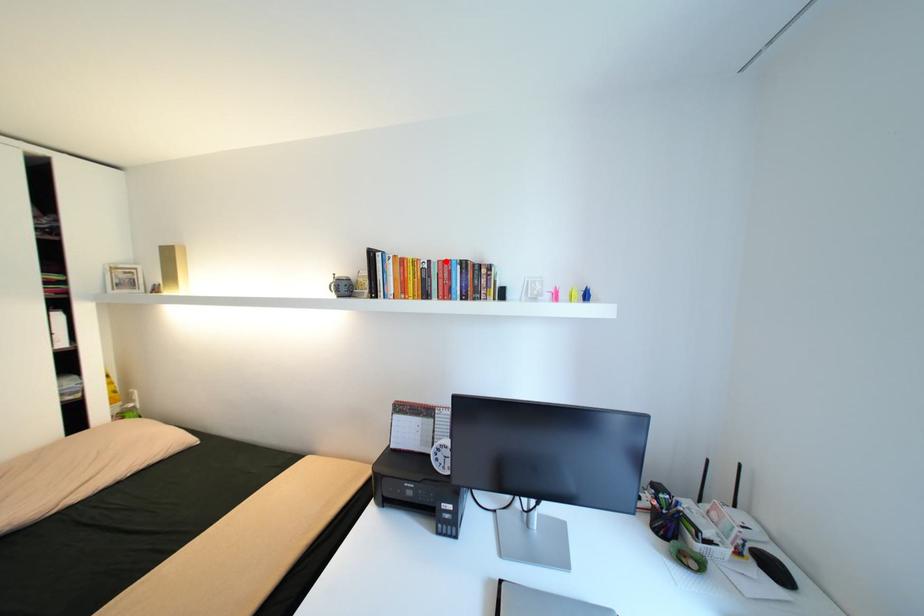
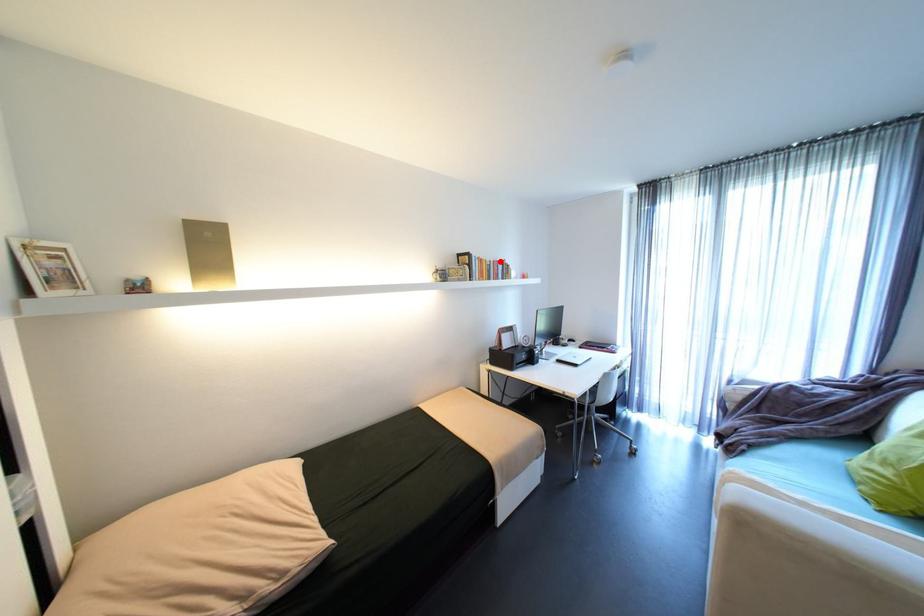
I am providing you with two images of the same scene from different viewpoints. A red point is marked on the first image and another point is marked on the second image. Are the points marked in image1 and image2 representing the same 3D position?

Yes